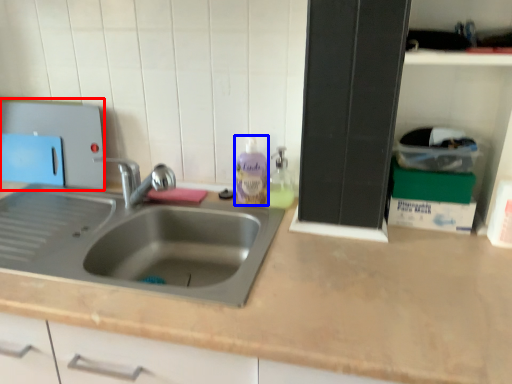
Question: Among these objects, which one is nearest to the camera, appliance (highlighted by a red box) or cleaning product (highlighted by a blue box)?

Choices:
 (A) appliance
 (B) cleaning product

Answer: (B)